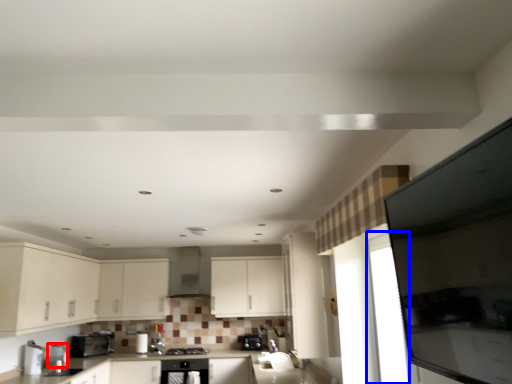
Question: Among these objects, which one is farthest to the camera, appliance (highlighted by a red box) or glass door (highlighted by a blue box)?

Choices:
 (A) appliance
 (B) glass door

Answer: (A)